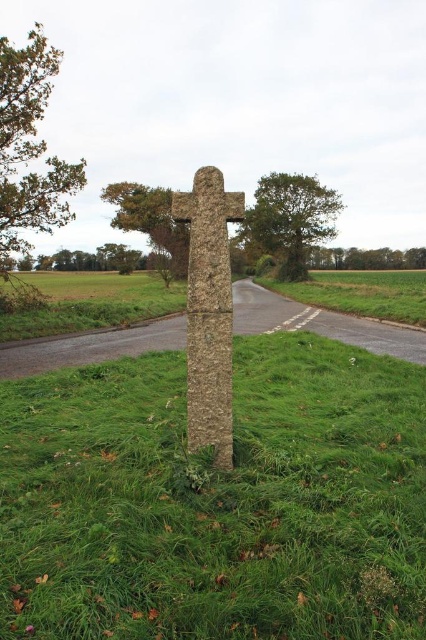
You are a hiker standing at the base of the stone cross. You notice two green leafy trees in the scene. Which tree, the green leafy tree at upper left or the green leafy tree at center, appears closer to you?

The green leafy tree at upper left is positioned over the green leafy tree at center, meaning it is closer to you.

You are a landscape architect designing a path that must pass between the green grassy at center and the green leafy tree at upper center. Which side of the path should be closer to the narrower object to ensure the path is wide enough for a 2m wide vehicle?

The green grassy at center has a smaller width than the green leafy tree at upper center. To ensure the path is wide enough for a 2m wide vehicle, the path should be closer to the narrower green grassy at center so that the wider space between them accommodates the vehicle.